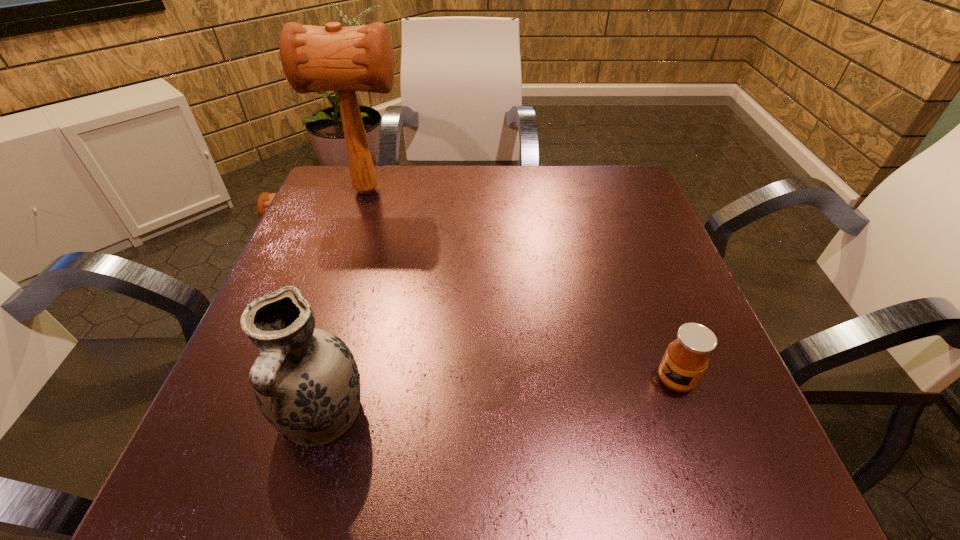
Find the location of a particular element. the tallest object is located at coordinates (314, 58).

You are a GUI agent. You are given a task and a screenshot of the screen. Output one action in this format:
    pyautogui.click(x=<x>, y=<y>)
    Task: Click on the mallet
    
    Given the screenshot: What is the action you would take?
    pyautogui.click(x=314, y=58)

Where is `the second tallest object`? This screenshot has width=960, height=540. the second tallest object is located at coordinates (306, 382).

Where is `the rightmost object`? Image resolution: width=960 pixels, height=540 pixels. the rightmost object is located at coordinates (687, 357).

Locate an element on the screen. This screenshot has width=960, height=540. the shortest object is located at coordinates (687, 357).

Where is `vacant space located on the strike surface of the tallest object`? The image size is (960, 540). vacant space located on the strike surface of the tallest object is located at coordinates (429, 191).

Where is `free point located on the front-facing side of the shortest object`? Image resolution: width=960 pixels, height=540 pixels. free point located on the front-facing side of the shortest object is located at coordinates (613, 380).

Locate an element on the screen. vacant space located 0.290m on the front-facing side of the shortest object is located at coordinates (480, 380).

I want to click on blank space located on the front-facing side of the shortest object, so click(425, 380).

The height and width of the screenshot is (540, 960). I want to click on object at the far edge, so click(314, 58).